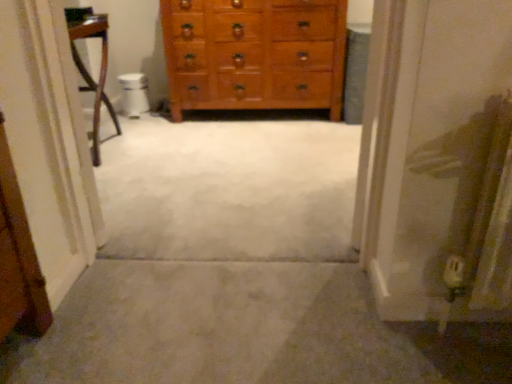
Question: Is carpet at center positioned beyond the bounds of white glossy toilet bowl at center?

Choices:
 (A) yes
 (B) no

Answer: (A)

Question: Considering the relative positions of carpet at center and white glossy toilet bowl at center in the image provided, is carpet at center in front of white glossy toilet bowl at center?

Choices:
 (A) no
 (B) yes

Answer: (B)

Question: Is carpet at center further to camera compared to white glossy toilet bowl at center?

Choices:
 (A) yes
 (B) no

Answer: (B)

Question: Is carpet at center next to white glossy toilet bowl at center and touching it?

Choices:
 (A) no
 (B) yes

Answer: (A)

Question: Can you confirm if carpet at center is thinner than white glossy toilet bowl at center?

Choices:
 (A) yes
 (B) no

Answer: (B)

Question: From a real-world perspective, is carpet at center positioned over white glossy toilet bowl at center based on gravity?

Choices:
 (A) no
 (B) yes

Answer: (A)

Question: Can you confirm if wooden chest of drawers at center is wider than white glossy toilet bowl at center?

Choices:
 (A) no
 (B) yes

Answer: (B)

Question: Does wooden chest of drawers at center contain white glossy toilet bowl at center?

Choices:
 (A) no
 (B) yes

Answer: (A)

Question: Considering the relative positions of wooden chest of drawers at center and white glossy toilet bowl at center in the image provided, is wooden chest of drawers at center to the right of white glossy toilet bowl at center from the viewer's perspective?

Choices:
 (A) no
 (B) yes

Answer: (B)

Question: Can you confirm if wooden chest of drawers at center is taller than white glossy toilet bowl at center?

Choices:
 (A) no
 (B) yes

Answer: (B)

Question: Would you say wooden chest of drawers at center is outside white glossy toilet bowl at center?

Choices:
 (A) no
 (B) yes

Answer: (B)

Question: Does wooden chest of drawers at center have a larger size compared to white glossy toilet bowl at center?

Choices:
 (A) no
 (B) yes

Answer: (B)

Question: Is carpet at center surrounded by wooden chest of drawers at center?

Choices:
 (A) yes
 (B) no

Answer: (B)